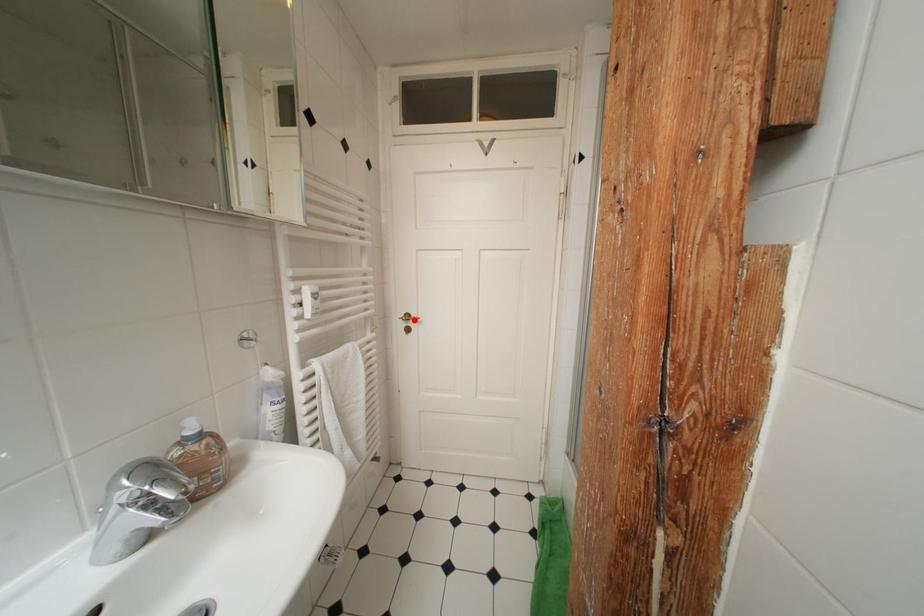
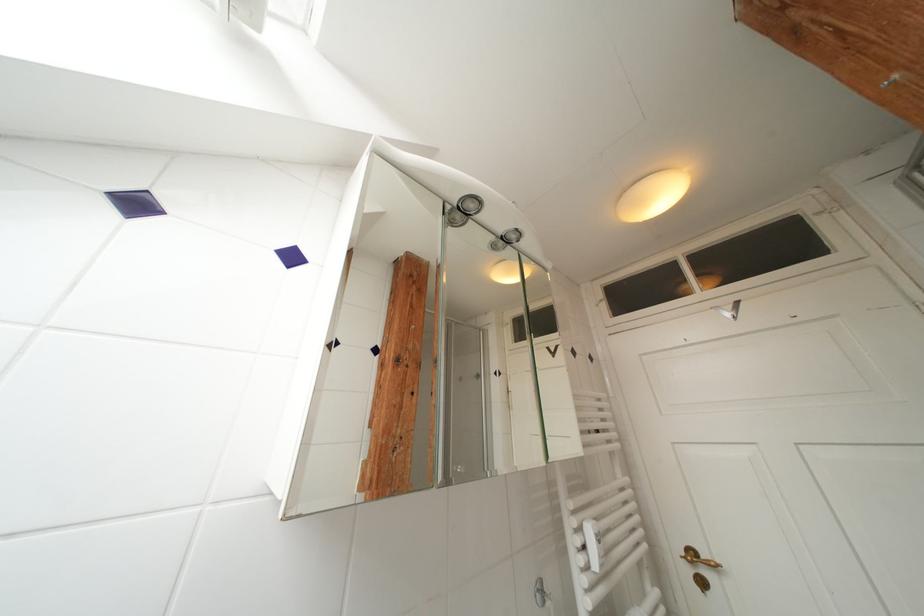
In the second image, find the point that corresponds to the highlighted location in the first image.

(699, 557)